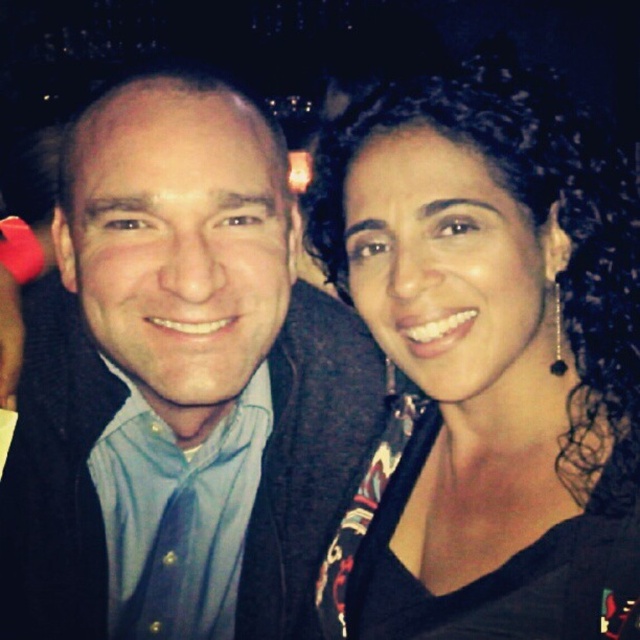
Question: Is blue shirt at center thinner than black fabric at center?

Choices:
 (A) no
 (B) yes

Answer: (A)

Question: Which of the following is the farthest from the observer?

Choices:
 (A) (132, 99)
 (B) (600, 458)

Answer: (A)

Question: Does blue shirt at center appear over black fabric at center?

Choices:
 (A) yes
 (B) no

Answer: (B)

Question: From the image, what is the correct spatial relationship of blue shirt at center in relation to black fabric at center?

Choices:
 (A) above
 (B) below

Answer: (B)

Question: Which object is farther from the camera taking this photo?

Choices:
 (A) black fabric at center
 (B) blue shirt at center

Answer: (B)